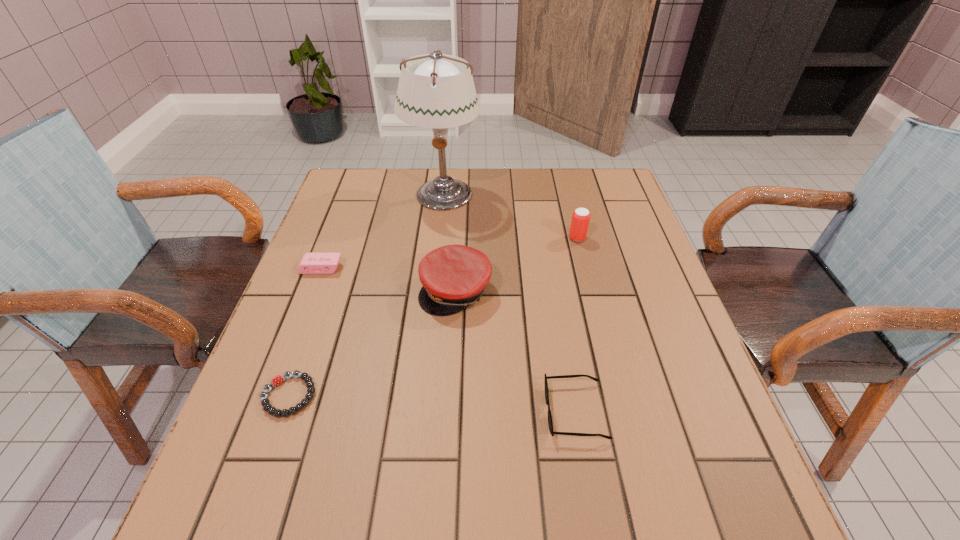
Image resolution: width=960 pixels, height=540 pixels. In order to click on the farthest object in this screenshot , I will do `click(435, 90)`.

Where is `the tallest object`? Image resolution: width=960 pixels, height=540 pixels. the tallest object is located at coordinates (435, 90).

Find the location of a particular element. This screenshot has height=540, width=960. the fifth nearest object is located at coordinates (580, 220).

You are a GUI agent. You are given a task and a screenshot of the screen. Output one action in this format:
    pyautogui.click(x=<x>, y=<y>)
    Task: Click on the beer can
    The image size is (960, 540).
    Given the screenshot: What is the action you would take?
    pyautogui.click(x=580, y=220)

Find the location of a particular element. This screenshot has height=540, width=960. cap is located at coordinates (453, 277).

Identify the location of eraser. The width and height of the screenshot is (960, 540). (311, 263).

Locate an element on the screen. sunglasses is located at coordinates click(550, 423).

At what (x,y) coordinates should I click in order to perform the action: click on bracelet. Please return your answer as a coordinate pair (x, y). This screenshot has height=540, width=960. Looking at the image, I should click on (267, 407).

At what (x,y) coordinates should I click in order to perform the action: click on vacant area situated 0.250m on the lampshade of the tallest object. Please return your answer as a coordinate pair (x, y). The width and height of the screenshot is (960, 540). Looking at the image, I should click on (434, 278).

The image size is (960, 540). I want to click on free space located 0.080m on the right of the rightmost object, so [x=615, y=238].